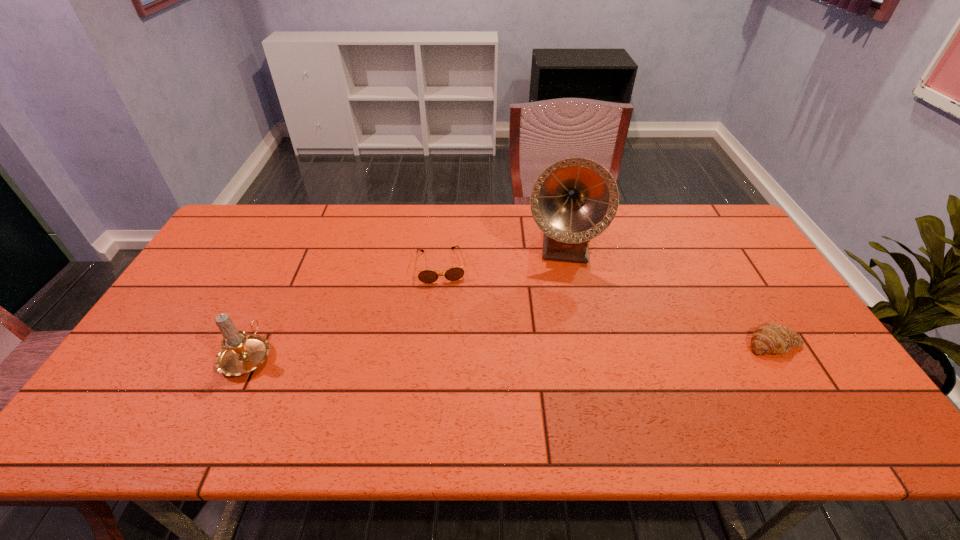
This screenshot has width=960, height=540. Identify the location of vacant space located on the horn of the tallest object. (560, 336).

This screenshot has width=960, height=540. What are the coordinates of `free spot located 0.290m on the front-facing side of the sunglasses` in the screenshot? It's located at (454, 362).

Image resolution: width=960 pixels, height=540 pixels. I want to click on blank space located 0.260m on the front-facing side of the sunglasses, so click(452, 353).

The height and width of the screenshot is (540, 960). I want to click on free region located on the front-facing side of the sunglasses, so click(x=459, y=401).

The width and height of the screenshot is (960, 540). Identify the location of object that is at the far edge. (574, 200).

This screenshot has width=960, height=540. Identify the location of object at the near edge. (241, 353).

This screenshot has width=960, height=540. I want to click on object that is at the right edge, so [x=768, y=338].

The height and width of the screenshot is (540, 960). I want to click on vacant space at the far edge of the desktop, so coord(649,224).

You are a GUI agent. You are given a task and a screenshot of the screen. Output one action in this format:
    pyautogui.click(x=<x>, y=<y>)
    Task: Click on the vacant space at the near edge
    The image size is (960, 540).
    Given the screenshot: What is the action you would take?
    pyautogui.click(x=420, y=385)

The height and width of the screenshot is (540, 960). In the image, there is a desktop. Find the location of `vacant space at the left edge`. vacant space at the left edge is located at coordinates (212, 249).